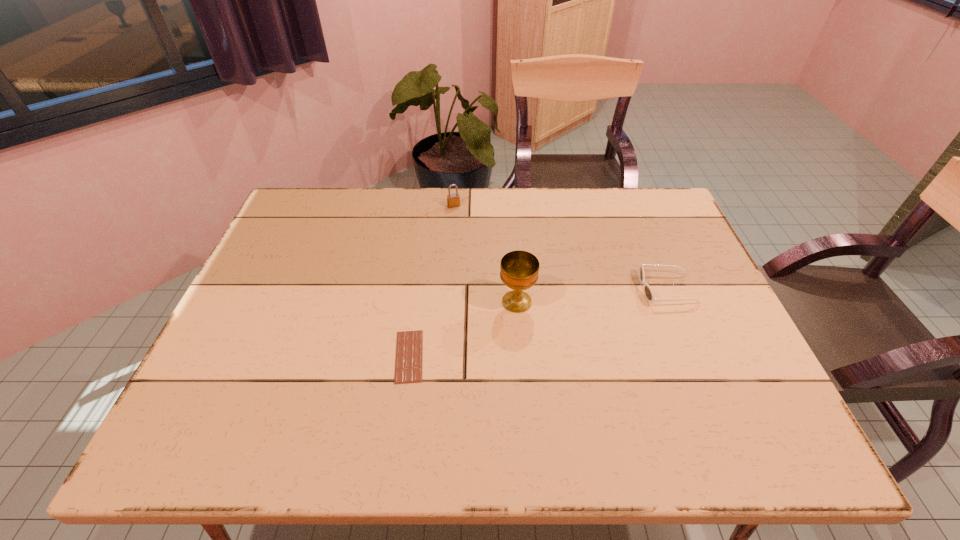
Locate an element on the screen. unoccupied position between the second object from right to left and the shortest object is located at coordinates (463, 329).

This screenshot has height=540, width=960. Identify the location of vacant region between the shortest object and the rightmost object. (538, 322).

Identify the location of free area in between the second shortest object and the nearest object. The height and width of the screenshot is (540, 960). (538, 322).

You are a GUI agent. You are given a task and a screenshot of the screen. Output one action in this format:
    pyautogui.click(x=<x>, y=<y>)
    Task: Click on the unoccupied position between the third object from right to left and the chocolate bar
    The width and height of the screenshot is (960, 540).
    Given the screenshot: What is the action you would take?
    pyautogui.click(x=431, y=281)

The width and height of the screenshot is (960, 540). What are the coordinates of `vacant space that's between the third tallest object and the shortest object` in the screenshot? It's located at (538, 322).

The image size is (960, 540). I want to click on free space between the nearest object and the second tallest object, so click(431, 281).

Image resolution: width=960 pixels, height=540 pixels. I want to click on vacant space in between the third shortest object and the third object from left to right, so click(485, 254).

The image size is (960, 540). Identify the location of free area in between the nearest object and the tallest object. (463, 329).

At what (x,y) coordinates should I click in order to perform the action: click on empty space that is in between the third object from left to right and the sunglasses. Please return your answer as a coordinate pair (x, y). The image size is (960, 540). Looking at the image, I should click on (591, 295).

You are a GUI agent. You are given a task and a screenshot of the screen. Output one action in this format:
    pyautogui.click(x=<x>, y=<y>)
    Task: Click on the empty space between the nearest object and the rightmost object
    The width and height of the screenshot is (960, 540).
    Given the screenshot: What is the action you would take?
    pyautogui.click(x=538, y=322)